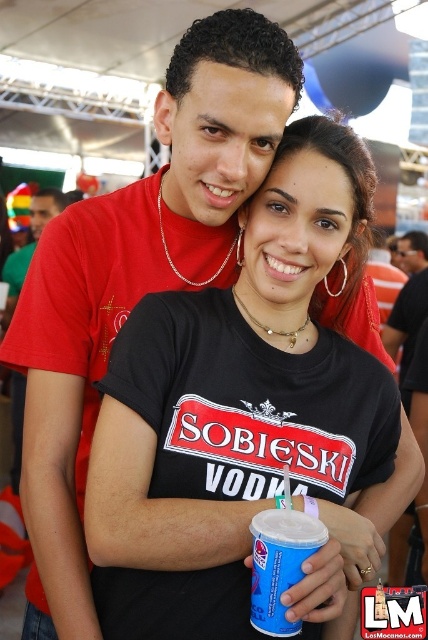
Between black matte cup at center and matte red t-shirt at upper left, which one has more height?

matte red t-shirt at upper left

Between black matte cup at center and matte red t-shirt at upper left, which one appears on the left side from the viewer's perspective?

From the viewer's perspective, matte red t-shirt at upper left appears more on the left side.

Which is behind, point (151, 524) or point (14, 481)?

Point (14, 481)

The image size is (428, 640). I want to click on black matte cup at center, so click(x=237, y=404).

Can you confirm if black matte cup at center is smaller than blue paper cup at center?

Actually, black matte cup at center might be larger than blue paper cup at center.

Is point (244, 262) closer to camera compared to point (264, 573)?

No, it is not.

The image size is (428, 640). What are the coordinates of `black matte cup at center` in the screenshot? It's located at (237, 404).

Which of these two, blue paper cup at center or matte red t-shirt at upper left, stands shorter?

blue paper cup at center

Is point (273, 602) in front of point (5, 307)?

Yes, it is.

At what (x,y) coordinates should I click in order to perform the action: click on blue paper cup at center. Please return your answer as a coordinate pair (x, y). Looking at the image, I should click on (279, 563).